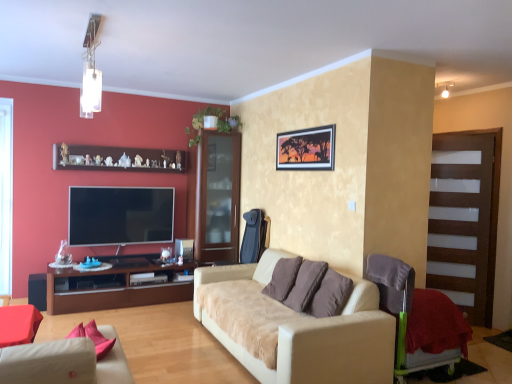
What do you see at coordinates (18, 324) in the screenshot?
I see `matte red chair at lower left, the first chair in the left-to-right sequence` at bounding box center [18, 324].

Describe the element at coordinates (436, 324) in the screenshot. I see `red textured blanket at lower right` at that location.

You are a GUI agent. You are given a task and a screenshot of the screen. Output one action in this format:
    pyautogui.click(x=<x>, y=<y>)
    Task: Click on the brown glass cabinet at center
    The width and height of the screenshot is (512, 384).
    Given the screenshot: What is the action you would take?
    pyautogui.click(x=217, y=197)

I want to click on transparent glass window screen at left, so click(6, 194).

Locate an element on the screen. Image resolution: width=512 pixels, height=384 pixels. matte red chair at lower left, the 2th chair positioned from the right is located at coordinates (18, 324).

Between point (432, 329) and point (429, 259), which one is positioned in front?

The point (432, 329) is more forward.

Can you confirm if red textured blanket at lower right is taller than transparent glass cabinet at right?

No, red textured blanket at lower right is not taller than transparent glass cabinet at right.

This screenshot has width=512, height=384. I want to click on armoire behind the red textured blanket at lower right, so click(x=464, y=219).

Considering the relative sizes of red textured blanket at lower right and transparent glass cabinet at right in the image provided, is red textured blanket at lower right thinner than transparent glass cabinet at right?

Incorrect, the width of red textured blanket at lower right is not less than that of transparent glass cabinet at right.

Is brown fabric pillow at center inside the boundaries of red textured blanket at lower right, or outside?

brown fabric pillow at center is outside red textured blanket at lower right.

Considering the relative sizes of brown fabric pillow at center and red textured blanket at lower right in the image provided, is brown fabric pillow at center thinner than red textured blanket at lower right?

Yes, brown fabric pillow at center is thinner than red textured blanket at lower right.

Can you confirm if brown fabric pillow at center is bigger than red textured blanket at lower right?

No, brown fabric pillow at center is not bigger than red textured blanket at lower right.

Consider the image. In the image, is brown fabric pillow at center on the left side or the right side of red textured blanket at lower right?

Based on their positions, brown fabric pillow at center is located to the left of red textured blanket at lower right.

From the image's perspective, would you say beige fabric couch at center, positioned as the second studio couch in front-to-back order, is shown under velvet purple chair at lower right, which ranks as the 1th chair in right-to-left order?

Yes.

Is beige fabric couch at center, the 1th studio couch when ordered from back to front, bigger than velvet purple chair at lower right, acting as the 1th chair starting from the back?

Indeed, beige fabric couch at center, the 1th studio couch when ordered from back to front, has a larger size compared to velvet purple chair at lower right, acting as the 1th chair starting from the back.

Is point (269, 328) closer or farther from the camera than point (387, 268)?

Clearly, point (269, 328) is closer to the camera than point (387, 268).

Identify the location of chair that is the 1st object located above the beige fabric couch at center, the 2th studio couch when ordered from left to right (from the image's perspective). This screenshot has width=512, height=384. (404, 315).

From the image's perspective, would you say brown wood cabinet at left is positioned over matte beige studio couch at lower left, which ranks as the 1th studio couch in left-to-right order?

No, from the image's perspective, brown wood cabinet at left is not over matte beige studio couch at lower left, which ranks as the 1th studio couch in left-to-right order.

Where is `cabinetry lying on the left of matte beige studio couch at lower left, positioned as the second studio couch in back-to-front order`? This screenshot has height=384, width=512. cabinetry lying on the left of matte beige studio couch at lower left, positioned as the second studio couch in back-to-front order is located at coordinates coord(117,285).

Measure the distance between brown wood cabinet at left and matte beige studio couch at lower left, which is the second studio couch from right to left.

brown wood cabinet at left is 2.60 meters away from matte beige studio couch at lower left, which is the second studio couch from right to left.

Is transparent glass window screen at left with flat screen tv at left?

No, transparent glass window screen at left is not with flat screen tv at left.

From a real-world perspective, which object rests below the other?

From a 3D spatial view, flat screen tv at left is below.

Is point (7, 264) positioned behind point (71, 215)?

No, (7, 264) is closer to viewer.

From the image's perspective, does transparent glass window screen at left appear higher than flat screen tv at left?

Yes, from the image's perspective, transparent glass window screen at left is on top of flat screen tv at left.

Is wooden shelf at upper center bigger or smaller than matte red chair at lower left, the 2th chair positioned from the right?

Considering their sizes, wooden shelf at upper center takes up more space than matte red chair at lower left, the 2th chair positioned from the right.

Which is correct: wooden shelf at upper center is inside matte red chair at lower left, the 2th chair positioned from the right, or outside of it?

wooden shelf at upper center lies outside matte red chair at lower left, the 2th chair positioned from the right.

In terms of height, does wooden shelf at upper center look taller or shorter compared to matte red chair at lower left, arranged as the first chair when viewed from the front?

Considering their sizes, wooden shelf at upper center has more height than matte red chair at lower left, arranged as the first chair when viewed from the front.

Which object is positioned more to the right, wooden shelf at upper center or matte red chair at lower left, the first chair in the left-to-right sequence?

From the viewer's perspective, matte red chair at lower left, the first chair in the left-to-right sequence, appears more on the right side.

Does matte red chair at lower left, the 2th chair viewed from the back, have a greater height compared to matte beige studio couch at lower left, arranged as the 1th studio couch when viewed from the front?

Incorrect, the height of matte red chair at lower left, the 2th chair viewed from the back, is not larger of that of matte beige studio couch at lower left, arranged as the 1th studio couch when viewed from the front.

In the image, is matte red chair at lower left, the 2th chair positioned from the right, positioned in front of or behind matte beige studio couch at lower left, which is the second studio couch from right to left?

Clearly, matte red chair at lower left, the 2th chair positioned from the right, is behind matte beige studio couch at lower left, which is the second studio couch from right to left.

Is matte red chair at lower left, the 2th chair positioned from the right, not close to matte beige studio couch at lower left, which is the second studio couch from right to left?

That's not correct — matte red chair at lower left, the 2th chair positioned from the right, is a little close to matte beige studio couch at lower left, which is the second studio couch from right to left.

Based on the photo, is matte red chair at lower left, arranged as the first chair when viewed from the front, located outside matte beige studio couch at lower left, arranged as the 1th studio couch when viewed from the front?

No, matte red chair at lower left, arranged as the first chair when viewed from the front, is not entirely external to matte beige studio couch at lower left, arranged as the 1th studio couch when viewed from the front.

The width and height of the screenshot is (512, 384). What are the coordinates of `armoire that is above the red textured blanket at lower right (from the image's perspective)` in the screenshot? It's located at (464, 219).

You are a GUI agent. You are given a task and a screenshot of the screen. Output one action in this format:
    pyautogui.click(x=<x>, y=<y>)
    Task: Click on the pillow that appears above the red textured blanket at lower right (from a real-world perspective)
    This screenshot has height=384, width=512.
    Given the screenshot: What is the action you would take?
    pyautogui.click(x=309, y=287)

When comparing their distances from flat screen tv at left, does red textured blanket at lower right or beige fabric couch at center, the 1th studio couch when ordered from right to left, seem closer?

The object closer to flat screen tv at left is beige fabric couch at center, the 1th studio couch when ordered from right to left.

When comparing their distances from beige fabric couch at center, positioned as the second studio couch in front-to-back order, does brown wood cabinet at left or transparent glass cabinet at right seem further?

transparent glass cabinet at right is further to beige fabric couch at center, positioned as the second studio couch in front-to-back order.

Which object lies further to the anchor point wooden shelf at upper center, transparent glass cabinet at right or brown fabric pillow at center?

transparent glass cabinet at right is further to wooden shelf at upper center.

When comparing their distances from transparent glass cabinet at right, does beige fabric couch at center, the 1th studio couch when ordered from right to left, or velvet purple chair at lower right, which ranks as the second chair in front-to-back order, seem closer?

velvet purple chair at lower right, which ranks as the second chair in front-to-back order, is positioned closer to the anchor transparent glass cabinet at right.

Considering their positions, is transparent glass cabinet at right positioned closer to brown wood cabinet at left than matte black picture frame at upper center?

The object closer to brown wood cabinet at left is matte black picture frame at upper center.

Based on their spatial positions, is brown wood cabinet at left or transparent glass cabinet at right closer to wooden shelf at upper center?

brown wood cabinet at left lies closer to wooden shelf at upper center than the other object.

When comparing their distances from velvet purple chair at lower right, acting as the 1th chair starting from the back, does matte red chair at lower left, the 2th chair positioned from the right, or red textured blanket at lower right seem further?

matte red chair at lower left, the 2th chair positioned from the right, is positioned further to the anchor velvet purple chair at lower right, acting as the 1th chair starting from the back.

Looking at this image, based on their spatial positions, is red textured blanket at lower right or brown fabric pillow at center further from brown glass cabinet at center?

The object further to brown glass cabinet at center is red textured blanket at lower right.

You are a GUI agent. You are given a task and a screenshot of the screen. Output one action in this format:
    pyautogui.click(x=<x>, y=<y>)
    Task: Click on the pillow between beige fabric couch at center, positioned as the second studio couch in front-to-back order, and velvet purple chair at lower right, which ranks as the 1th chair in right-to-left order, in the horizontal direction
    The width and height of the screenshot is (512, 384).
    Given the screenshot: What is the action you would take?
    pyautogui.click(x=309, y=287)

Identify the location of picture frame between velvet purple chair at lower right, which ranks as the second chair in front-to-back order, and brown glass cabinet at center, along the z-axis. (306, 149).

This screenshot has height=384, width=512. I want to click on cabinetry between transparent glass window screen at left and matte black picture frame at upper center, so point(117,285).

At what (x,y) coordinates should I click in order to perform the action: click on picture frame between matte red chair at lower left, the first chair in the left-to-right sequence, and wooden shelf at upper center in the front-back direction. Please return your answer as a coordinate pair (x, y). Looking at the image, I should click on (306, 149).